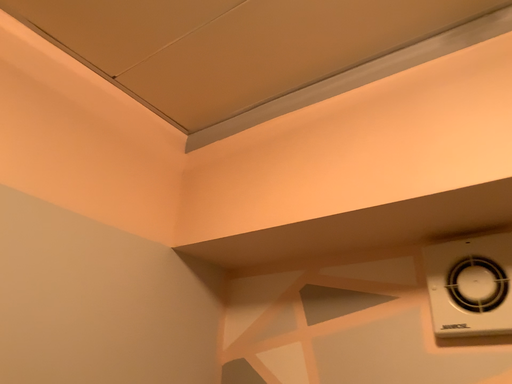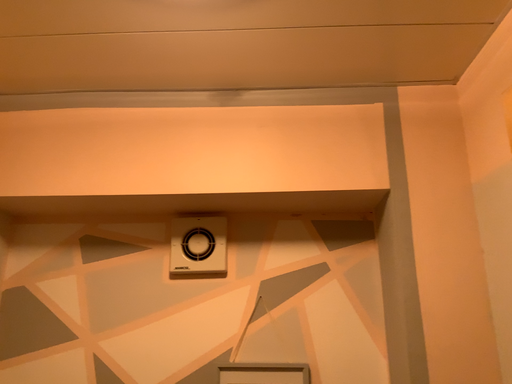
Question: How did the camera likely rotate when shooting the video?

Choices:
 (A) rotated upward
 (B) rotated downward

Answer: (B)